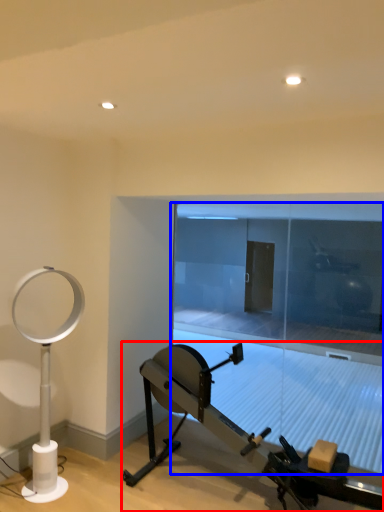
Question: Among these objects, which one is nearest to the camera, stationary bicycle (highlighted by a red box) or glass door (highlighted by a blue box)?

Choices:
 (A) stationary bicycle
 (B) glass door

Answer: (A)